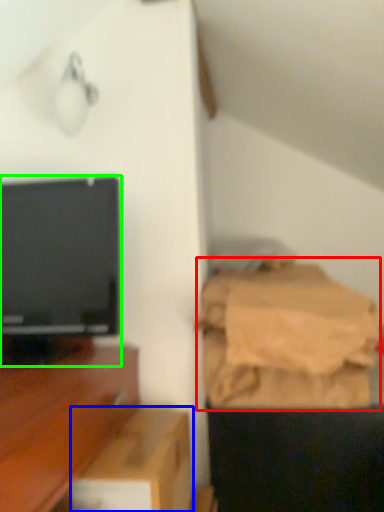
Question: Which object is positioned farthest from sheet (highlighted by a red box)? Select from cardboard box (highlighted by a blue box) and television (highlighted by a green box).

Choices:
 (A) cardboard box
 (B) television

Answer: (B)